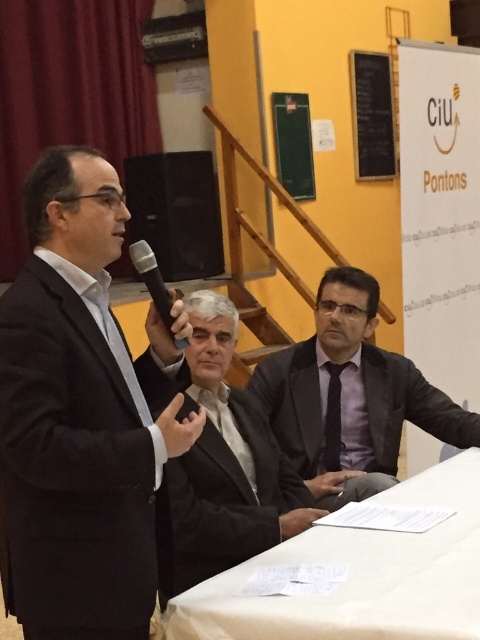
Who is shorter, black matte speaker at upper center or black plastic microphone at center?

black plastic microphone at center

Describe the element at coordinates (176, 211) in the screenshot. This screenshot has height=640, width=480. I see `black matte speaker at upper center` at that location.

This screenshot has height=640, width=480. I want to click on black matte speaker at upper center, so click(176, 211).

Between dark gray suit at center and black matte speaker at upper center, which one is positioned higher?

black matte speaker at upper center is higher up.

Who is lower down, dark gray suit at center or black matte speaker at upper center?

dark gray suit at center

Does point (235, 496) come behind point (182, 216)?

That is False.

Image resolution: width=480 pixels, height=640 pixels. Find the location of `dark gray suit at center`. dark gray suit at center is located at coordinates (223, 467).

Between black chalkboard at upper right and black plastic microphone at center, which one has less height?

With less height is black plastic microphone at center.

What do you see at coordinates (372, 115) in the screenshot? I see `black chalkboard at upper right` at bounding box center [372, 115].

You are a GUI agent. You are given a task and a screenshot of the screen. Output one action in this format:
    pyautogui.click(x=<x>, y=<y>)
    Task: Click on the black chalkboard at upper right
    This screenshot has width=480, height=640.
    Given the screenshot: What is the action you would take?
    pyautogui.click(x=372, y=115)